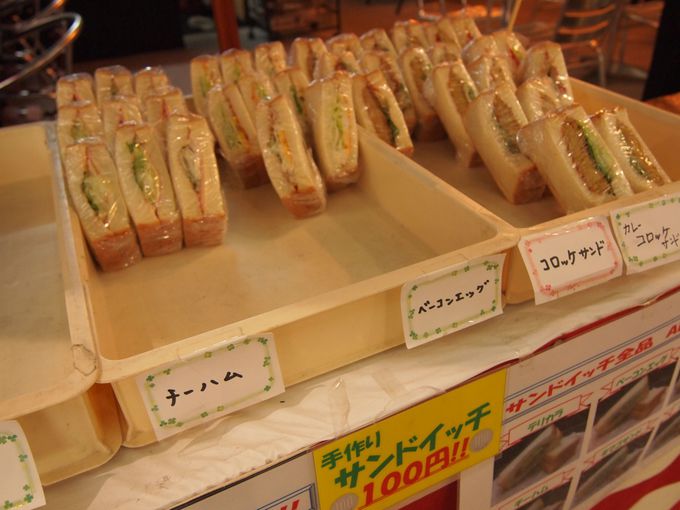
The width and height of the screenshot is (680, 510). I want to click on tray, so click(x=45, y=382), click(x=313, y=294), click(x=545, y=222).